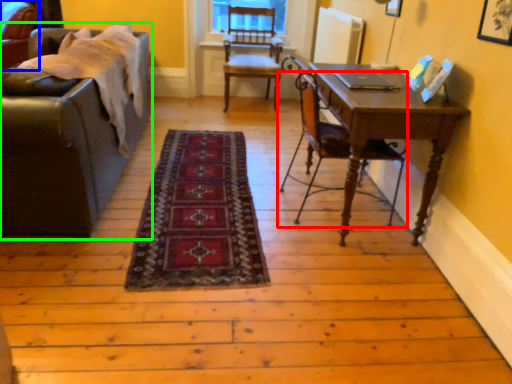
Question: Based on their relative distances, which object is nearer to chair (highlighted by a red box)? Choose from chair (highlighted by a blue box) and studio couch (highlighted by a green box).

Choices:
 (A) chair
 (B) studio couch

Answer: (B)